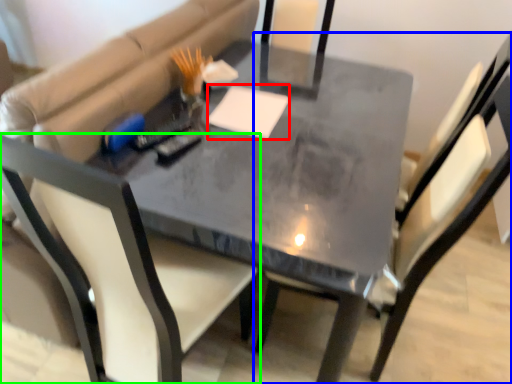
Question: Estimate the real-world distances between objects in this image. Which object is farther from notepad (highlighted by a red box), chair (highlighted by a blue box) or chair (highlighted by a green box)?

Choices:
 (A) chair
 (B) chair

Answer: (B)